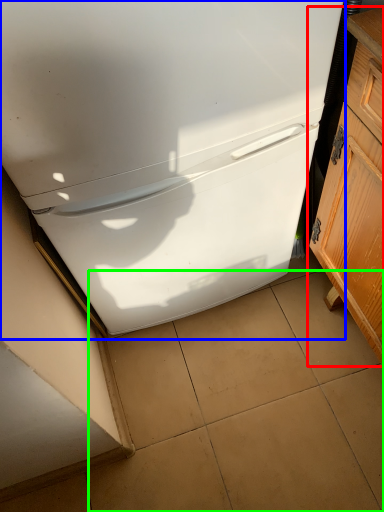
Question: Estimate the real-world distances between objects in this image. Which object is farther from cabinetry (highlighted by a red box), refrigerator (highlighted by a blue box) or tile (highlighted by a green box)?

Choices:
 (A) refrigerator
 (B) tile

Answer: (B)